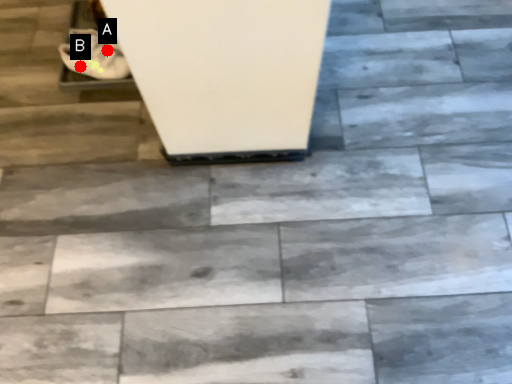
Question: Two points are circled on the image, labeled by A and B beside each circle. Which point is farther to the camera?

Choices:
 (A) A is further
 (B) B is further

Answer: (A)